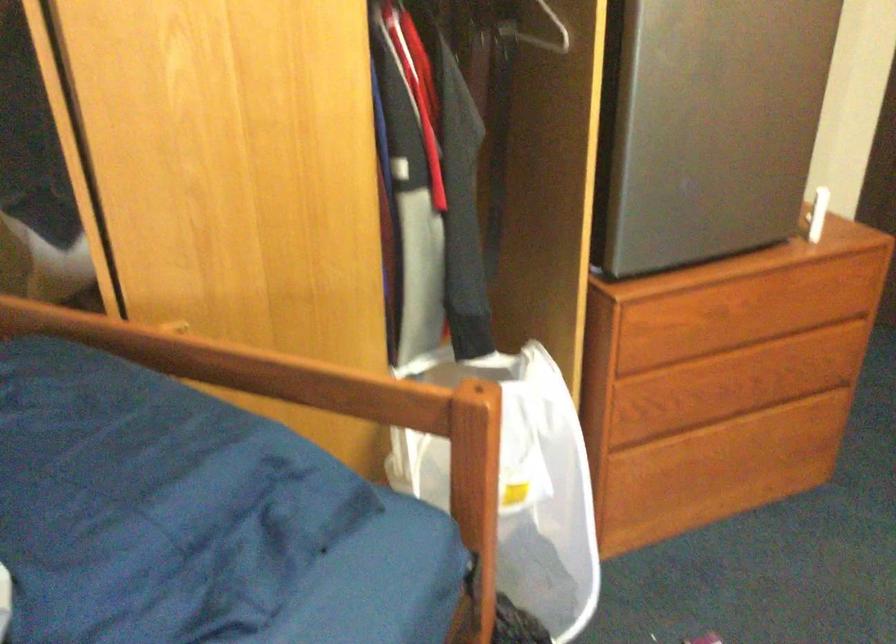
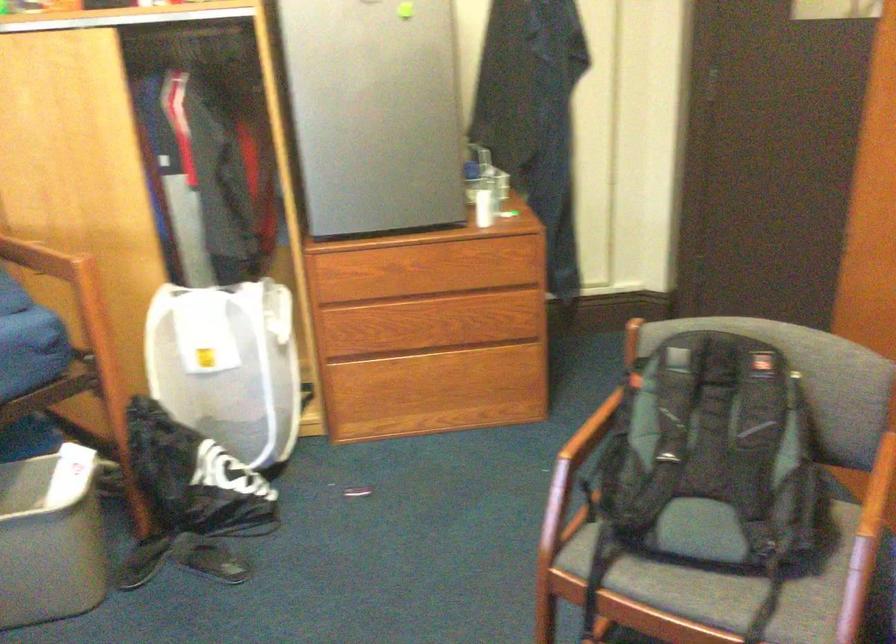
Where in the second image is the point corresponding to point 754,370 from the first image?

(445, 322)